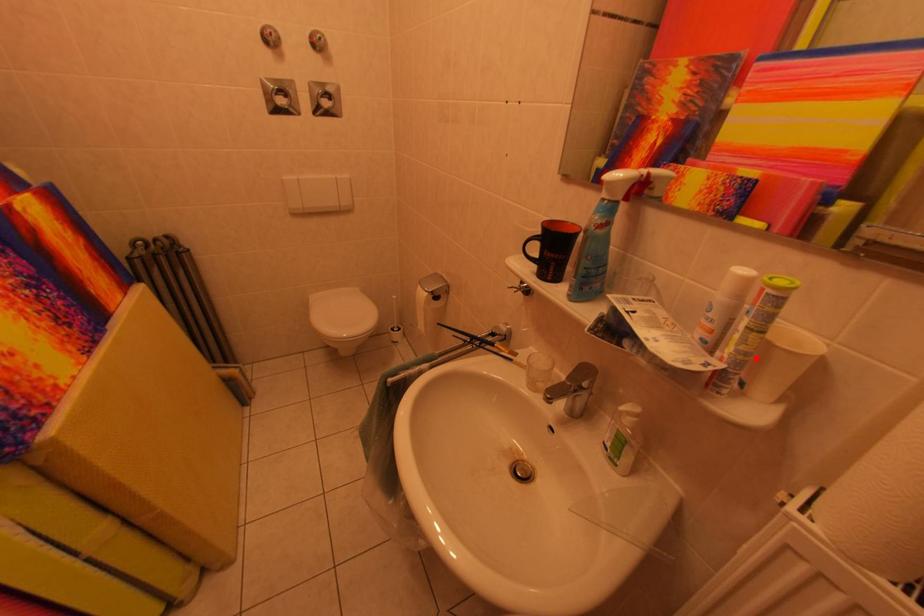
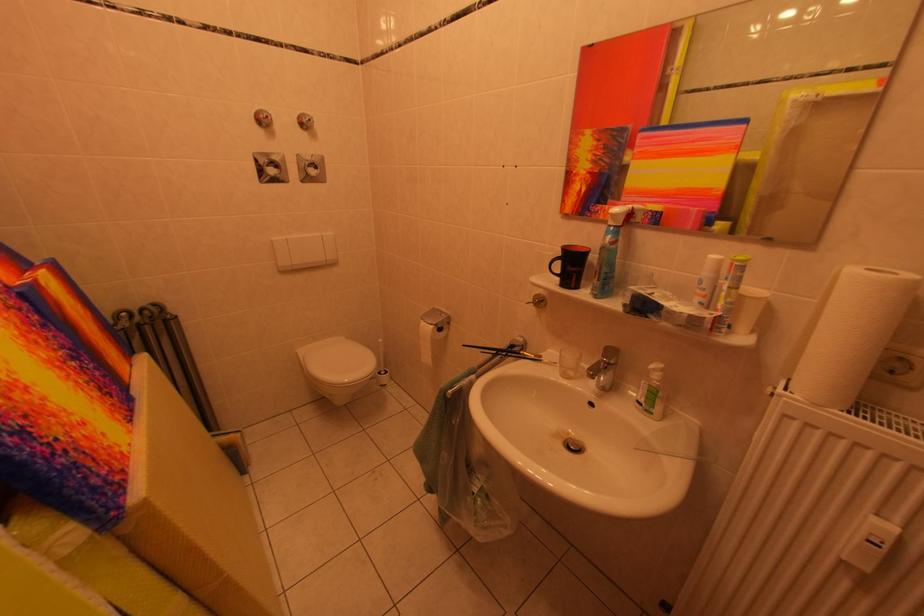
In the second image, find the point that corresponds to the highlighted location in the first image.

(739, 307)